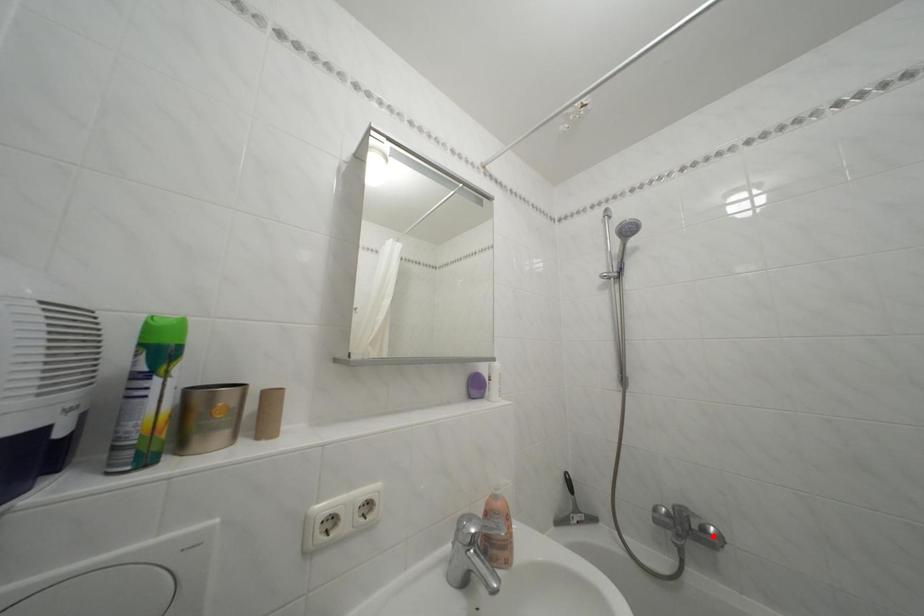
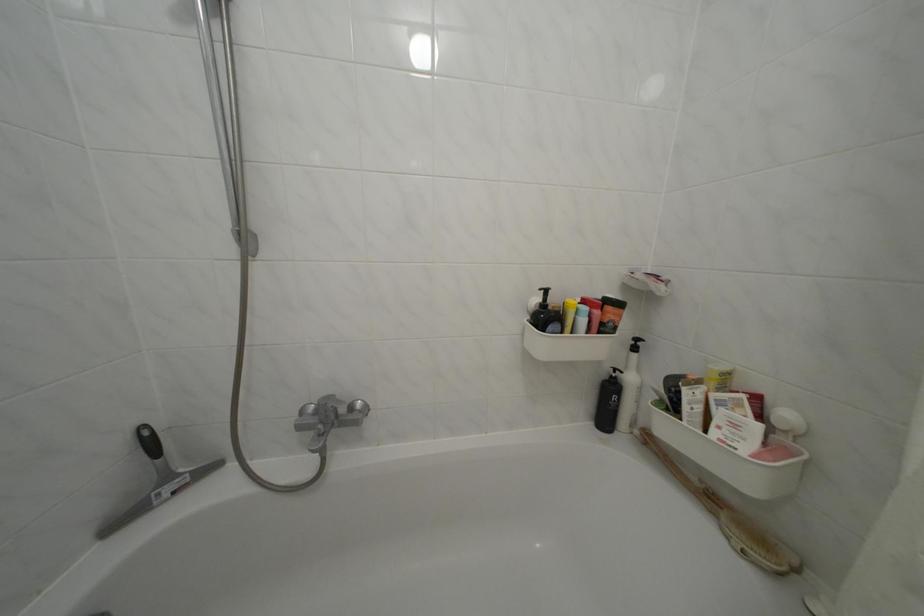
The point at the highlighted location is marked in the first image. Where is the corresponding point in the second image?

(359, 414)